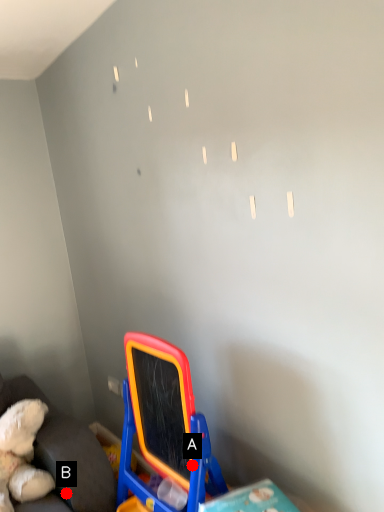
Question: Two points are circled on the image, labeled by A and B beside each circle. Which point is farther to the camera?

Choices:
 (A) A is further
 (B) B is further

Answer: (B)